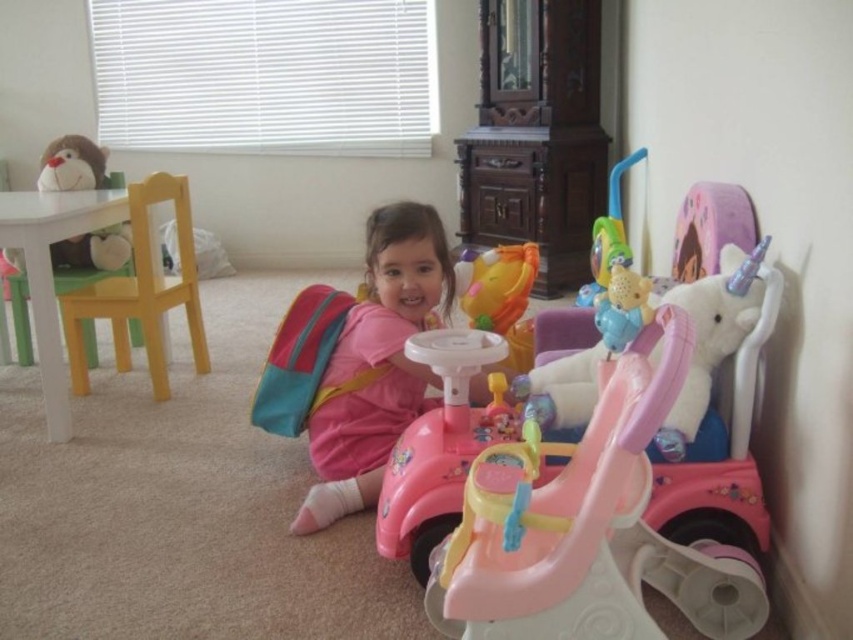
You are a parent trying to locate your child who is playing in the playroom. You see the pink matte backpack at center. Is the camera closer to the backpack or farther away than 6 feet?

The pink matte backpack at center and camera are 5.65 feet apart from each other, so the camera is closer than 6 feet to the backpack.

You are a parent trying to decide where to place a new toy box in the playroom. You want it to be between the yellow matte chair at left and the fluffy plush monkey at upper left. Considering their heights, which object should the toy box be placed closer to to ensure it is visible to a child sitting on the floor?

The yellow matte chair at left is much taller than the fluffy plush monkey at upper left. To ensure the toy box is visible to a child sitting on the floor, it should be placed closer to the shorter fluffy plush monkey at upper left so that it doesn

You are a parent looking for your child who is playing in the playroom. You see the pink matte backpack at center and the fluffy plush monkey at upper left. Where would you find the child in relation to these items?

The child is likely sitting next to the pink matte backpack at center, which is positioned below the fluffy plush monkey at upper left.